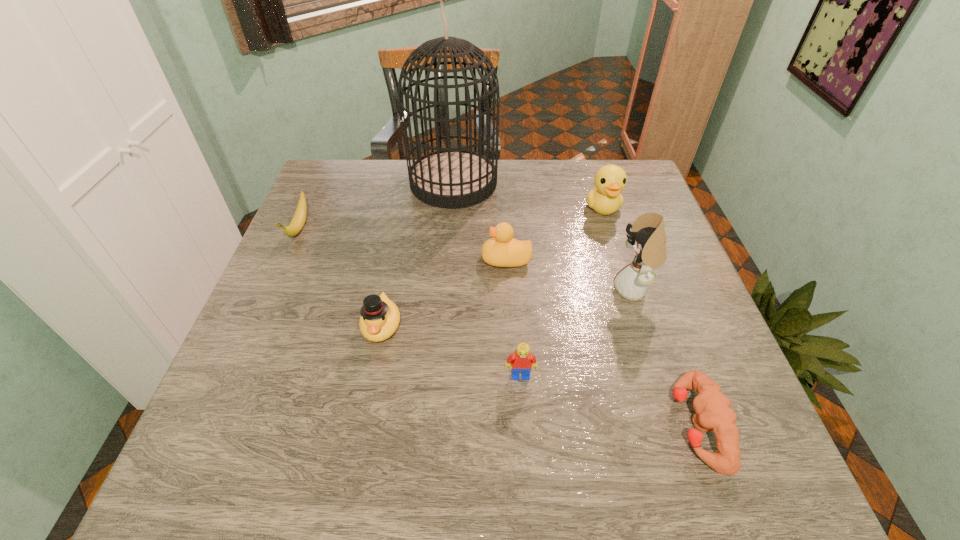
The width and height of the screenshot is (960, 540). I want to click on vacant space located with the gloves of the shortest object facing forward, so click(507, 425).

This screenshot has height=540, width=960. I want to click on vacant region located with the gloves of the shortest object facing forward, so click(x=610, y=425).

The width and height of the screenshot is (960, 540). What are the coordinates of `vacant space located 0.350m with the gloves of the shortest object facing forward` in the screenshot? It's located at (472, 425).

In order to click on birdcage that is at the far edge in this screenshot , I will do `click(451, 178)`.

The image size is (960, 540). What are the coordinates of `duck present at the far edge` in the screenshot? It's located at (605, 198).

What are the coordinates of `object that is at the near edge` in the screenshot? It's located at (713, 413).

Identify the location of object that is at the left edge. (299, 218).

Where is `doll located at the right edge`? doll located at the right edge is located at coordinates (648, 238).

At what (x,y) coordinates should I click in order to perform the action: click on duck that is at the right edge. Please return your answer as a coordinate pair (x, y). The width and height of the screenshot is (960, 540). Looking at the image, I should click on (605, 198).

Identify the location of puncher that is at the right edge. (713, 413).